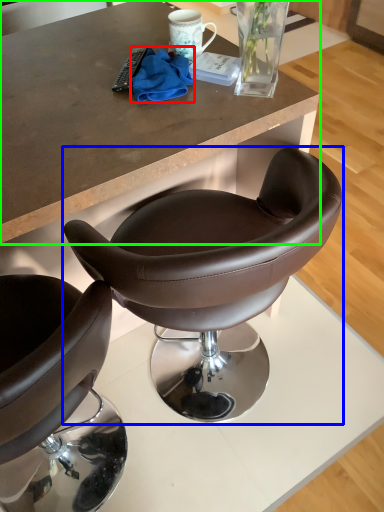
Question: Which is nearer to the material (highlighted by a red box)? chair (highlighted by a blue box) or desk (highlighted by a green box).

Choices:
 (A) chair
 (B) desk

Answer: (B)